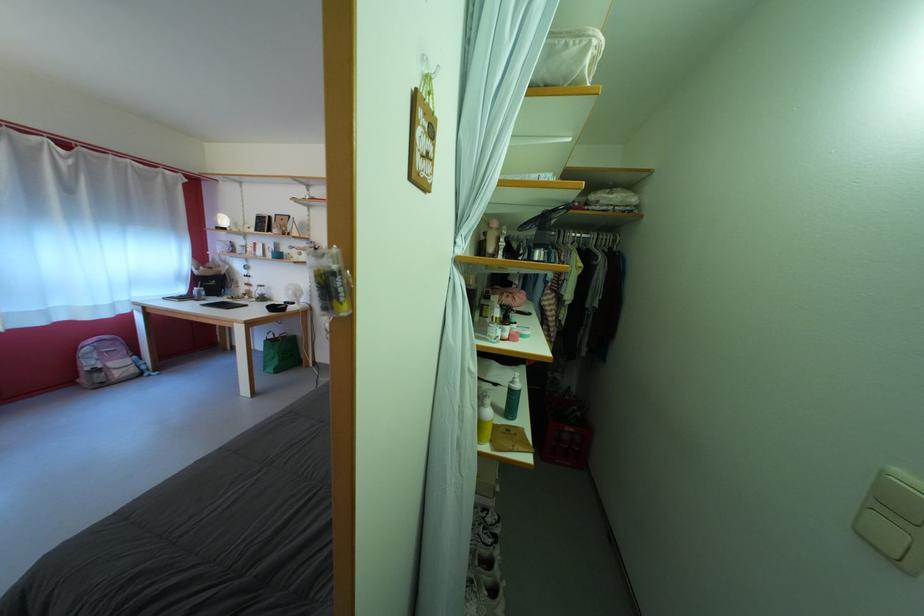
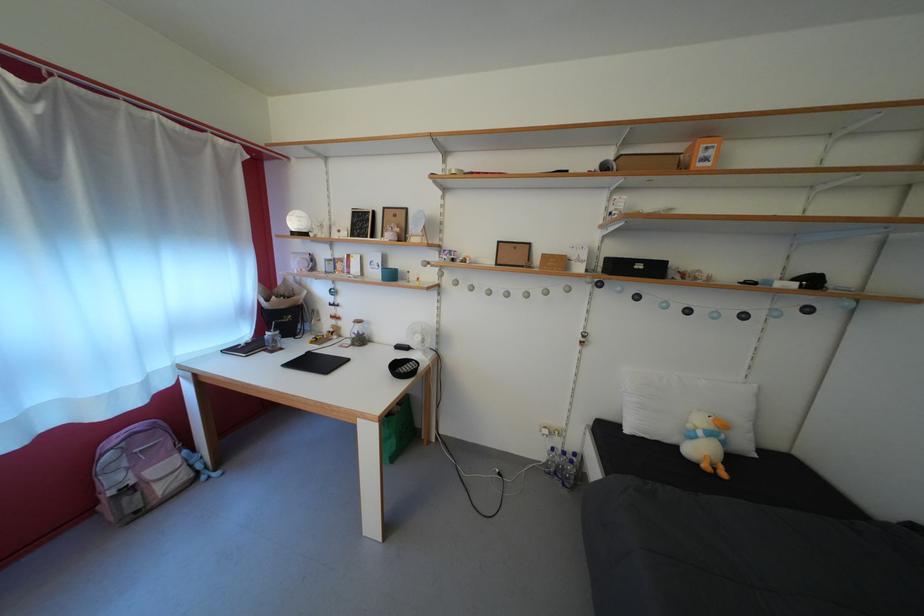
The point at (277, 261) is marked in the first image. Where is the corresponding point in the second image?

(383, 280)